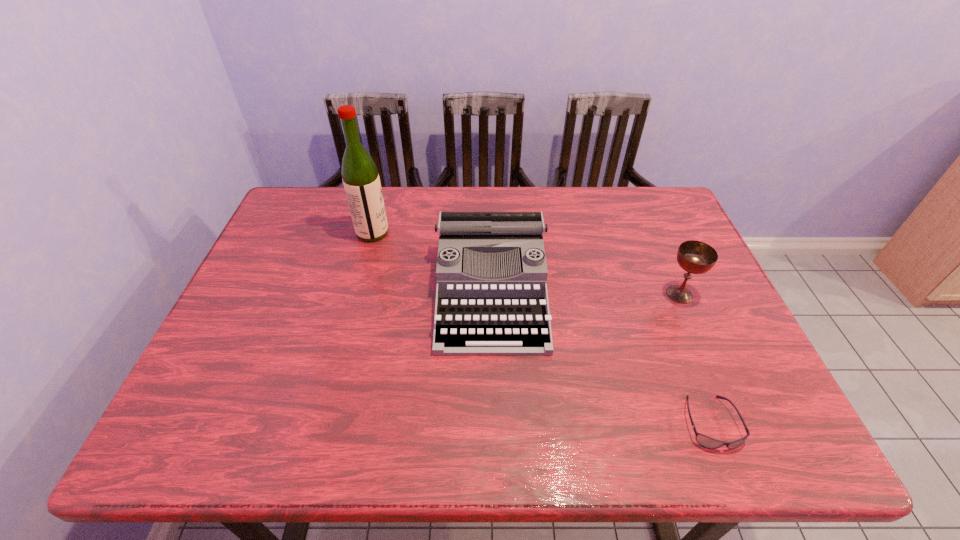
At what (x,y) coordinates should I click in order to perform the action: click on free spot between the tallest object and the typewriter. Please return your answer as a coordinate pair (x, y). This screenshot has height=540, width=960. Looking at the image, I should click on (432, 262).

The width and height of the screenshot is (960, 540). I want to click on object that is the nearest to the nearest object, so pyautogui.click(x=696, y=257).

Identify which object is the nearest to the chalice. Please provide its 2D coordinates. Your answer should be formatted as a tuple, i.e. [(x, y)], where the tuple contains the x and y coordinates of a point satisfying the conditions above.

[(705, 441)]

Locate an element on the screen. free space that satisfies the following two spatial constraints: 1. on the label of the tallest object; 2. on the right side of the chalice is located at coordinates click(356, 294).

The height and width of the screenshot is (540, 960). Find the location of `vacant region that satisfies the following two spatial constraints: 1. on the typing side of the chalice; 2. on the right side of the third object from right to left`. vacant region that satisfies the following two spatial constraints: 1. on the typing side of the chalice; 2. on the right side of the third object from right to left is located at coordinates (492, 294).

Locate an element on the screen. This screenshot has height=540, width=960. free point that satisfies the following two spatial constraints: 1. on the label of the chalice; 2. on the right side of the liquor is located at coordinates (356, 294).